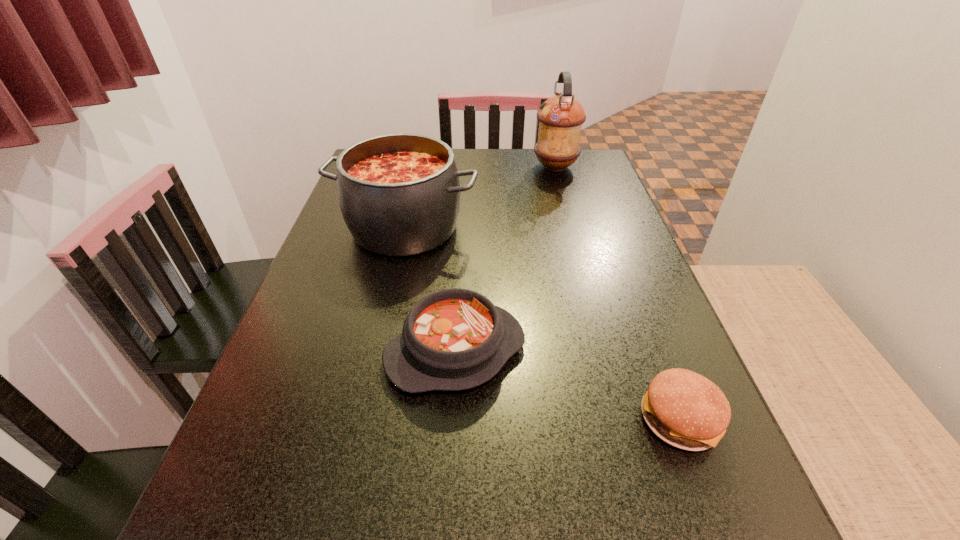
You are a GUI agent. You are given a task and a screenshot of the screen. Output one action in this format:
    pyautogui.click(x=<x>, y=<y>)
    Task: Click on the farthest object
    
    Given the screenshot: What is the action you would take?
    pyautogui.click(x=560, y=118)

In order to click on the tallest object in this screenshot , I will do `click(560, 118)`.

The image size is (960, 540). Find the location of `the taller casserole`. the taller casserole is located at coordinates (399, 194).

The width and height of the screenshot is (960, 540). Identify the location of the third nearest object. (399, 194).

I want to click on the shorter casserole, so click(x=454, y=339).

Find the location of a particular element. Image resolution: width=960 pixels, height=540 pixels. the nearer casserole is located at coordinates (454, 339).

You are a GUI agent. You are given a task and a screenshot of the screen. Output one action in this format:
    pyautogui.click(x=<x>, y=<y>)
    Task: Click on the hamburger
    The width and height of the screenshot is (960, 540).
    Given the screenshot: What is the action you would take?
    pyautogui.click(x=686, y=410)

Locate an element on the screen. The image size is (960, 540). vacant region located 0.100m on the left of the tallest object is located at coordinates (501, 167).

Identify the location of blank space located on the front of the taller casserole. (383, 327).

I want to click on free space located on the back of the nearer casserole, so click(x=463, y=218).